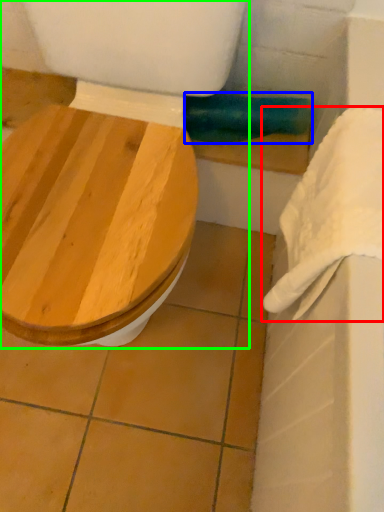
Question: Estimate the real-world distances between objects in this image. Which object is closer to towel/napkin (highlighted by a red box), towel bar (highlighted by a blue box) or toilet (highlighted by a green box)?

Choices:
 (A) towel bar
 (B) toilet

Answer: (B)